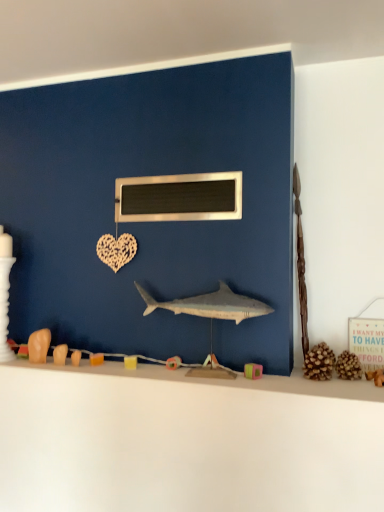
Question: Is white matte counter top at lower center far away from blue matte wall at center?

Choices:
 (A) yes
 (B) no

Answer: (B)

Question: Is white matte counter top at lower center to the right of blue matte wall at center from the viewer's perspective?

Choices:
 (A) no
 (B) yes

Answer: (B)

Question: Can you confirm if white matte counter top at lower center is bigger than blue matte wall at center?

Choices:
 (A) no
 (B) yes

Answer: (B)

Question: Is white matte counter top at lower center in front of blue matte wall at center?

Choices:
 (A) yes
 (B) no

Answer: (A)

Question: Is white matte counter top at lower center looking in the opposite direction of blue matte wall at center?

Choices:
 (A) yes
 (B) no

Answer: (B)

Question: Can you confirm if white matte counter top at lower center is taller than blue matte wall at center?

Choices:
 (A) yes
 (B) no

Answer: (B)

Question: Does metallic rectangular object at center turn towards white matte counter top at lower center?

Choices:
 (A) yes
 (B) no

Answer: (B)

Question: Is white matte counter top at lower center located within metallic rectangular object at center?

Choices:
 (A) no
 (B) yes

Answer: (A)

Question: Does metallic rectangular object at center appear on the right side of white matte counter top at lower center?

Choices:
 (A) yes
 (B) no

Answer: (A)

Question: Can you confirm if metallic rectangular object at center is bigger than white matte counter top at lower center?

Choices:
 (A) yes
 (B) no

Answer: (B)

Question: Is metallic rectangular object at center positioned before white matte counter top at lower center?

Choices:
 (A) no
 (B) yes

Answer: (A)

Question: Is metallic rectangular object at center in contact with white matte counter top at lower center?

Choices:
 (A) no
 (B) yes

Answer: (A)

Question: Can you confirm if white matte counter top at lower center is wider than metallic rectangular object at center?

Choices:
 (A) yes
 (B) no

Answer: (A)